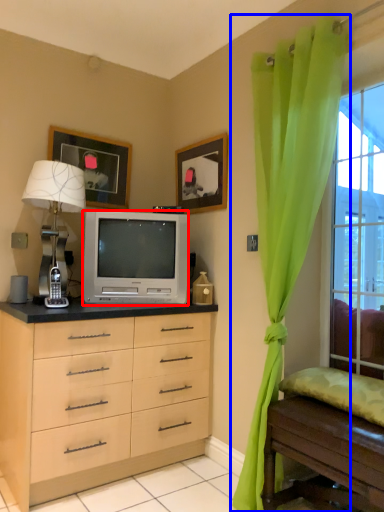
Question: Which object appears farthest to the camera in this image, television (highlighted by a red box) or curtain (highlighted by a blue box)?

Choices:
 (A) television
 (B) curtain

Answer: (A)